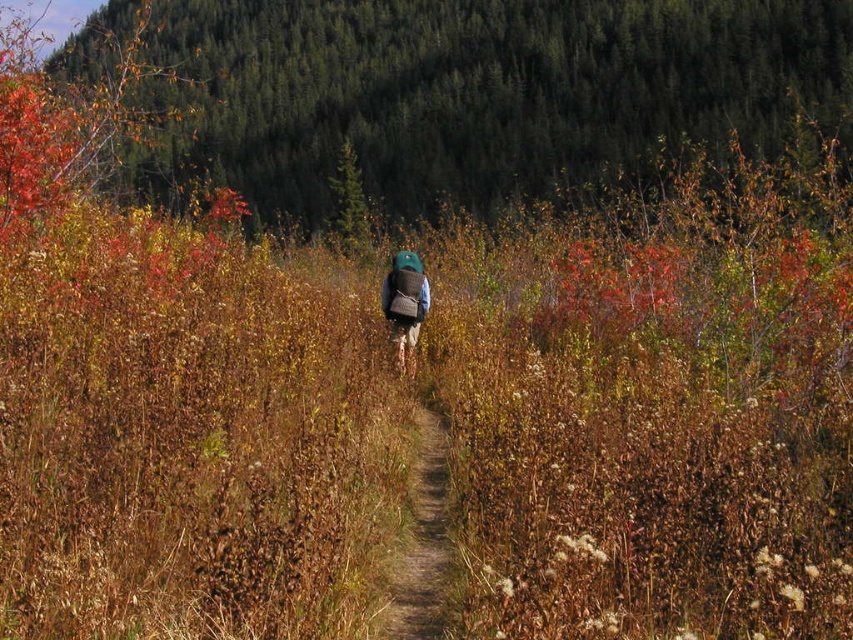
Question: Is brown dirt path at center above matte green backpack at center?

Choices:
 (A) yes
 (B) no

Answer: (B)

Question: Which point is farther to the camera?

Choices:
 (A) brown dirt path at center
 (B) green textured foliage at upper center
 (C) matte green backpack at center

Answer: (B)

Question: Which object appears farthest from the camera in this image?

Choices:
 (A) green textured foliage at upper center
 (B) matte green backpack at center

Answer: (A)

Question: Which object is the closest to the green textured foliage at upper center?

Choices:
 (A) matte green backpack at center
 (B) brown dirt path at center

Answer: (A)

Question: Does green textured foliage at upper center have a lesser width compared to brown dirt path at center?

Choices:
 (A) no
 (B) yes

Answer: (A)

Question: Is green textured foliage at upper center positioned at the back of brown dirt path at center?

Choices:
 (A) no
 (B) yes

Answer: (B)